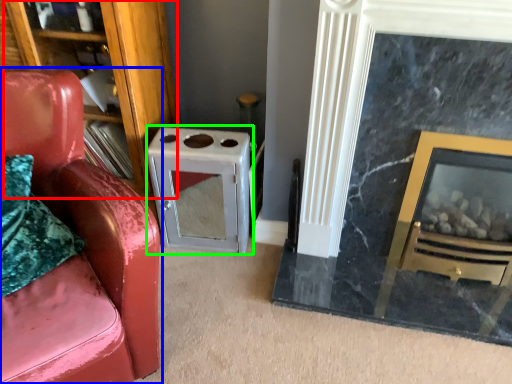
Question: Which is nearer to the bookshelf (highlighted by a red box)? chair (highlighted by a blue box) or appliance (highlighted by a green box).

Choices:
 (A) chair
 (B) appliance

Answer: (B)